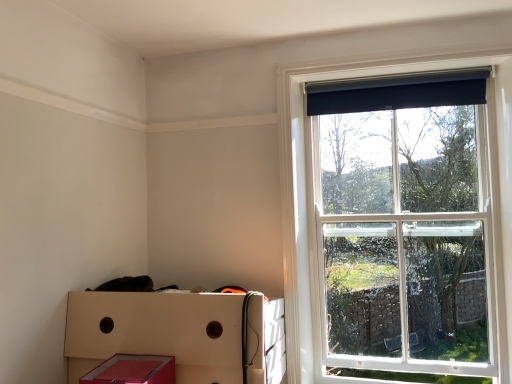
Question: Would you say matte red plastic crate at lower left is part of black fabric curtain at upper right's contents?

Choices:
 (A) no
 (B) yes

Answer: (A)

Question: From the image's perspective, is black fabric curtain at upper right over matte red plastic crate at lower left?

Choices:
 (A) yes
 (B) no

Answer: (A)

Question: Is black fabric curtain at upper right not within matte red plastic crate at lower left?

Choices:
 (A) no
 (B) yes

Answer: (B)

Question: Does black fabric curtain at upper right have a greater height compared to matte red plastic crate at lower left?

Choices:
 (A) yes
 (B) no

Answer: (B)

Question: Is black fabric curtain at upper right closer to the viewer compared to matte red plastic crate at lower left?

Choices:
 (A) yes
 (B) no

Answer: (B)

Question: Considering the positions of point (437, 102) and point (152, 375), is point (437, 102) closer or farther from the camera than point (152, 375)?

Choices:
 (A) closer
 (B) farther

Answer: (B)

Question: From the image's perspective, is black fabric curtain at upper right above or below matte red storage box at lower left?

Choices:
 (A) above
 (B) below

Answer: (A)

Question: From their relative heights in the image, would you say black fabric curtain at upper right is taller or shorter than matte red storage box at lower left?

Choices:
 (A) tall
 (B) short

Answer: (A)

Question: Relative to matte red storage box at lower left, is black fabric curtain at upper right in front or behind?

Choices:
 (A) front
 (B) behind

Answer: (B)

Question: Is black fabric curtain at upper right bigger or smaller than matte red plastic crate at lower left?

Choices:
 (A) big
 (B) small

Answer: (B)

Question: In the image, is black fabric curtain at upper right positioned in front of or behind matte red plastic crate at lower left?

Choices:
 (A) behind
 (B) front

Answer: (A)

Question: Would you say black fabric curtain at upper right is to the left or to the right of matte red plastic crate at lower left in the picture?

Choices:
 (A) right
 (B) left

Answer: (A)

Question: From a real-world perspective, relative to matte red plastic crate at lower left, is black fabric curtain at upper right vertically above or below?

Choices:
 (A) below
 (B) above

Answer: (B)

Question: Is point [x=158, y=339] positioned closer to the camera than point [x=409, y=82]?

Choices:
 (A) farther
 (B) closer

Answer: (B)

Question: Is matte red plastic crate at lower left inside or outside of black fabric curtain at upper right?

Choices:
 (A) outside
 (B) inside

Answer: (A)